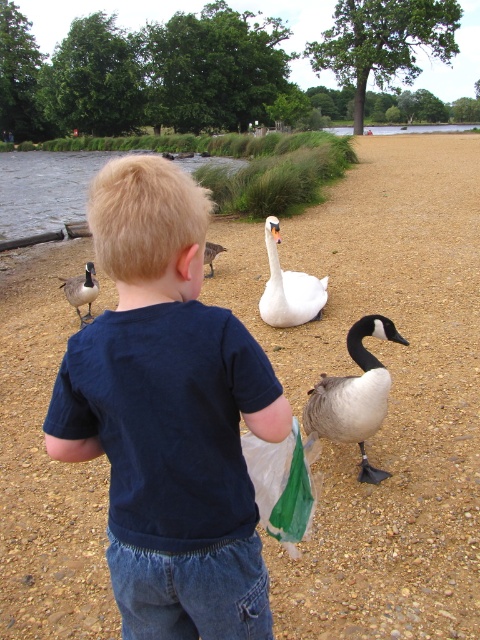
You are a photographer trying to capture the matte black duck at left and the clear water at lower left in the same frame. Based on their widths, which object should you focus on first to ensure both fit in the photo?

The clear water at lower left has a greater width than the matte black duck at left, so you should focus on the clear water at lower left first to ensure both fit in the photo.